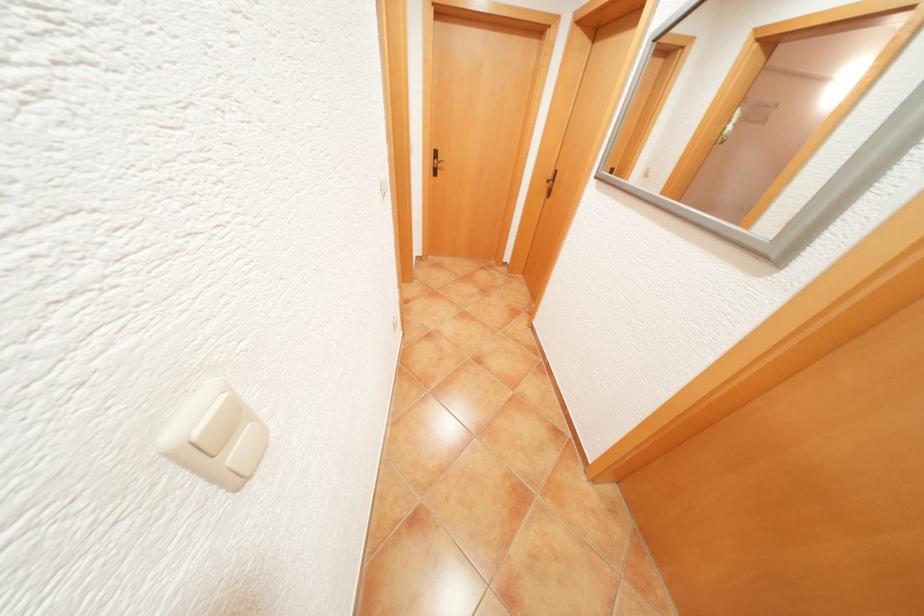
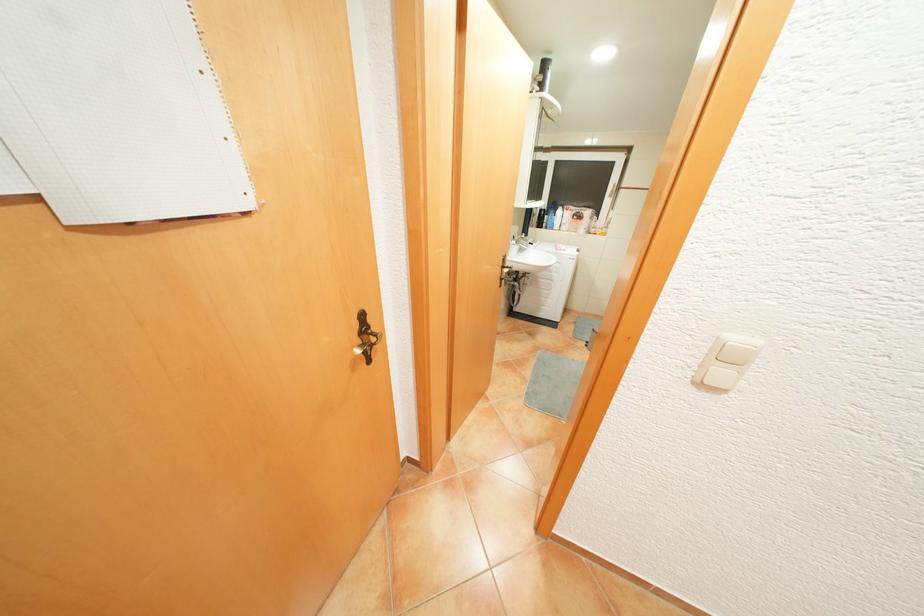
Based on the continuous images, in which direction is the camera rotating?

The rotation direction of the camera is left-down.